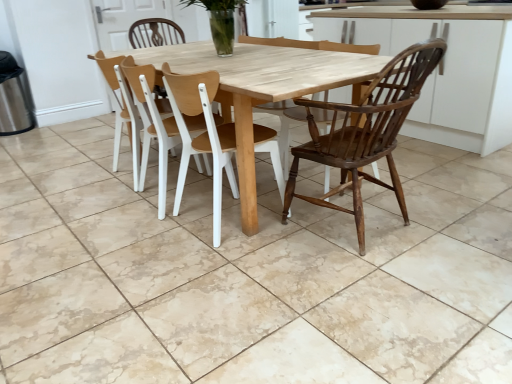
Question: Is light wood table at center positioned in front of clear glass vase at center?

Choices:
 (A) no
 (B) yes

Answer: (B)

Question: Is light wood table at center positioned beyond the bounds of clear glass vase at center?

Choices:
 (A) yes
 (B) no

Answer: (A)

Question: Does light wood table at center appear on the left side of clear glass vase at center?

Choices:
 (A) no
 (B) yes

Answer: (A)

Question: From the image's perspective, is light wood table at center above clear glass vase at center?

Choices:
 (A) yes
 (B) no

Answer: (B)

Question: Would you say clear glass vase at center is part of light wood table at center's contents?

Choices:
 (A) yes
 (B) no

Answer: (B)

Question: From a real-world perspective, is wooden at center, which ranks as the third chair in right-to-left order, above or below natural stone tile at center?

Choices:
 (A) below
 (B) above

Answer: (B)

Question: Relative to natural stone tile at center, is wooden at center, which ranks as the third chair in right-to-left order, in front or behind?

Choices:
 (A) front
 (B) behind

Answer: (B)

Question: In terms of height, does wooden at center, which ranks as the third chair in right-to-left order, look taller or shorter compared to natural stone tile at center?

Choices:
 (A) short
 (B) tall

Answer: (B)

Question: Is point (124, 87) positioned closer to the camera than point (229, 269)?

Choices:
 (A) closer
 (B) farther

Answer: (B)

Question: Based on their positions, is light wood table at center located to the left or right of clear glass vase at center?

Choices:
 (A) left
 (B) right

Answer: (B)

Question: In terms of size, does light wood table at center appear bigger or smaller than clear glass vase at center?

Choices:
 (A) big
 (B) small

Answer: (A)

Question: Considering the positions of light wood table at center and clear glass vase at center in the image, is light wood table at center taller or shorter than clear glass vase at center?

Choices:
 (A) tall
 (B) short

Answer: (A)

Question: Considering the positions of point (245, 94) and point (200, 4), is point (245, 94) closer or farther from the camera than point (200, 4)?

Choices:
 (A) closer
 (B) farther

Answer: (A)

Question: In terms of height, does dark brown wood chair at right, the first chair in the right-to-left sequence, look taller or shorter compared to clear glass vase at center?

Choices:
 (A) short
 (B) tall

Answer: (B)

Question: From a real-world perspective, is dark brown wood chair at right, the first chair in the right-to-left sequence, positioned above or below clear glass vase at center?

Choices:
 (A) above
 (B) below

Answer: (B)